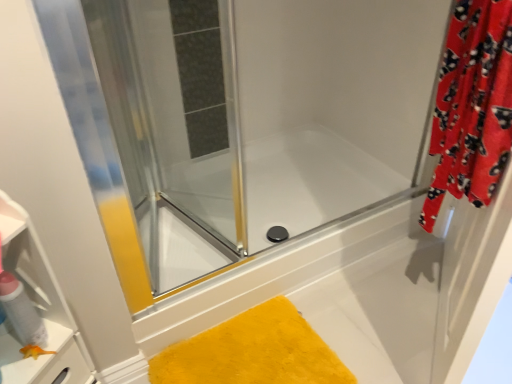
What is the approximate width of transparent glass shower door at upper left?

transparent glass shower door at upper left is 21.84 inches in width.

Where is `transparent glass shower door at upper left`? Image resolution: width=512 pixels, height=384 pixels. transparent glass shower door at upper left is located at coordinates (174, 128).

Is yellow fluffy bath mat at lower center in front of or behind transparent glass shower door at upper left in the image?

yellow fluffy bath mat at lower center is behind transparent glass shower door at upper left.

The image size is (512, 384). Identify the location of screen door that appears above the yellow fluffy bath mat at lower center (from a real-world perspective). (174, 128).

Which is closer, (158, 365) or (170, 46)?

The point (158, 365) is closer.

Does yellow fluffy bath mat at lower center have a larger size compared to transparent glass shower door at upper left?

No, yellow fluffy bath mat at lower center is not bigger than transparent glass shower door at upper left.

Does point (5, 307) appear closer or farther from the camera than point (202, 70)?

Point (5, 307) is closer to the camera than point (202, 70).

Between matte white spray can at left and transparent glass shower door at upper left, which one is positioned behind?

transparent glass shower door at upper left is behind.

Which object is thinner, matte white spray can at left or transparent glass shower door at upper left?

With smaller width is matte white spray can at left.

Find the location of `screen door behind the matte white spray can at left`. screen door behind the matte white spray can at left is located at coordinates pyautogui.click(x=174, y=128).

Is red fuzzy curtain at right taller than matte white spray can at left?

Correct, red fuzzy curtain at right is much taller as matte white spray can at left.

Is red fuzzy curtain at right inside the boundaries of matte white spray can at left, or outside?

red fuzzy curtain at right is not inside matte white spray can at left, it's outside.

Looking at this image, considering the relative sizes of red fuzzy curtain at right and matte white spray can at left in the image provided, is red fuzzy curtain at right smaller than matte white spray can at left?

Incorrect, red fuzzy curtain at right is not smaller in size than matte white spray can at left.

From the image's perspective, is red fuzzy curtain at right located beneath matte white spray can at left?

No, from the image's perspective, red fuzzy curtain at right is not beneath matte white spray can at left.

How different are the orientations of transparent glass shower door at upper left and yellow fluffy bath mat at lower center in degrees?

There is a 68.8-degree angle between the facing directions of transparent glass shower door at upper left and yellow fluffy bath mat at lower center.

Identify the location of bath mat located behind the transparent glass shower door at upper left. (253, 352).

From the image's perspective, which is below, transparent glass shower door at upper left or yellow fluffy bath mat at lower center?

yellow fluffy bath mat at lower center appears lower in the image.

Is the depth of transparent glass shower door at upper left less than that of yellow fluffy bath mat at lower center?

Yes, it is in front of yellow fluffy bath mat at lower center.

Is transparent glass shower door at upper left behind matte white spray can at left?

Yes, transparent glass shower door at upper left is further from the camera.

Is transparent glass shower door at upper left facing towards matte white spray can at left?

No, transparent glass shower door at upper left is not facing towards matte white spray can at left.

Does transparent glass shower door at upper left have a smaller size compared to matte white spray can at left?

No.

From the image's perspective, between transparent glass shower door at upper left and red fuzzy curtain at right, which one is located above?

transparent glass shower door at upper left, from the image's perspective.

From a real-world perspective, is transparent glass shower door at upper left under red fuzzy curtain at right?

Yes, from a real-world perspective, transparent glass shower door at upper left is beneath red fuzzy curtain at right.

Where is `curtain that is above the matte white spray can at left (from a real-world perspective)`? curtain that is above the matte white spray can at left (from a real-world perspective) is located at coordinates (472, 106).

Consider the image. From a real-world perspective, is matte white spray can at left on top of red fuzzy curtain at right?

No, from a real-world perspective, matte white spray can at left is not over red fuzzy curtain at right

Is red fuzzy curtain at right at the back of matte white spray can at left?

matte white spray can at left does not have its back to red fuzzy curtain at right.

Where is `screen door that appears above the yellow fluffy bath mat at lower center (from the image's perspective)`? The height and width of the screenshot is (384, 512). screen door that appears above the yellow fluffy bath mat at lower center (from the image's perspective) is located at coordinates (174, 128).

What are the coordinates of `screen door above the matte white spray can at left (from a real-world perspective)` in the screenshot? It's located at (174, 128).

From the image, which object appears to be nearer to red fuzzy curtain at right, matte white spray can at left or yellow fluffy bath mat at lower center?

Among the two, yellow fluffy bath mat at lower center is located nearer to red fuzzy curtain at right.

Based on their spatial positions, is transparent glass shower door at upper left or red fuzzy curtain at right further from matte white spray can at left?

Among the two, red fuzzy curtain at right is located further to matte white spray can at left.

When comparing their distances from transparent glass shower door at upper left, does red fuzzy curtain at right or matte white spray can at left seem further?

matte white spray can at left is further to transparent glass shower door at upper left.

Based on the photo, which object lies nearer to the anchor point red fuzzy curtain at right, matte white spray can at left or transparent glass shower door at upper left?

Based on the image, transparent glass shower door at upper left appears to be nearer to red fuzzy curtain at right.

From the image, which object appears to be farther from transparent glass shower door at upper left, matte white spray can at left or yellow fluffy bath mat at lower center?

matte white spray can at left is further to transparent glass shower door at upper left.

Consider the image. Which object lies nearer to the anchor point yellow fluffy bath mat at lower center, matte white spray can at left or red fuzzy curtain at right?

matte white spray can at left is positioned closer to the anchor yellow fluffy bath mat at lower center.

Estimate the real-world distances between objects in this image. Which object is closer to red fuzzy curtain at right, yellow fluffy bath mat at lower center or matte white spray can at left?

yellow fluffy bath mat at lower center is positioned closer to the anchor red fuzzy curtain at right.

From the image, which object appears to be farther from red fuzzy curtain at right, transparent glass shower door at upper left or matte white spray can at left?

matte white spray can at left is positioned further to the anchor red fuzzy curtain at right.

Locate an element on the screen. The image size is (512, 384). screen door between matte white spray can at left and red fuzzy curtain at right is located at coordinates (174, 128).

Where is `cleaning product between transparent glass shower door at upper left and yellow fluffy bath mat at lower center from top to bottom`? cleaning product between transparent glass shower door at upper left and yellow fluffy bath mat at lower center from top to bottom is located at coordinates (21, 311).

Where is `bath mat situated between matte white spray can at left and red fuzzy curtain at right from left to right`? This screenshot has width=512, height=384. bath mat situated between matte white spray can at left and red fuzzy curtain at right from left to right is located at coordinates (253, 352).

The height and width of the screenshot is (384, 512). I want to click on curtain between transparent glass shower door at upper left and yellow fluffy bath mat at lower center from top to bottom, so click(x=472, y=106).